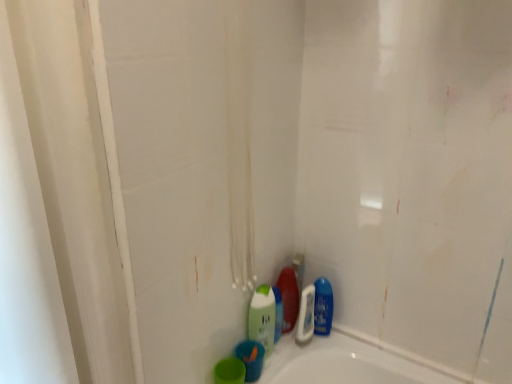
Question: From a real-world perspective, is blue glossy mouthwash at lower right, arranged as the 3th mouthwash when viewed from the left, physically below shiny plastic bottle at lower center, the second cleaning product viewed from the right?

Choices:
 (A) yes
 (B) no

Answer: (A)

Question: From the image's perspective, does blue glossy mouthwash at lower right, the first mouthwash when ordered from right to left, appear lower than shiny plastic bottle at lower center, the second cleaning product viewed from the right?

Choices:
 (A) yes
 (B) no

Answer: (A)

Question: Would you say blue glossy mouthwash at lower right, the first mouthwash when ordered from right to left, is outside shiny plastic bottle at lower center, the second cleaning product viewed from the right?

Choices:
 (A) yes
 (B) no

Answer: (A)

Question: Does blue glossy mouthwash at lower right, the first mouthwash when ordered from right to left, come in front of shiny plastic bottle at lower center, which is the 2th cleaning product in left-to-right order?

Choices:
 (A) yes
 (B) no

Answer: (B)

Question: Is blue glossy mouthwash at lower right, which is the 3th mouthwash from front to back, not close to shiny plastic bottle at lower center, the second cleaning product viewed from the right?

Choices:
 (A) no
 (B) yes

Answer: (A)

Question: Does blue glossy mouthwash at lower right, arranged as the 3th mouthwash when viewed from the left, have a smaller size compared to shiny plastic bottle at lower center, which is the 2th cleaning product in left-to-right order?

Choices:
 (A) no
 (B) yes

Answer: (A)

Question: Is green matte bottle at lower center, acting as the 1th cleaning product starting from the left, thinner than blue glossy mouthwash at lower right, acting as the 1th mouthwash starting from the back?

Choices:
 (A) yes
 (B) no

Answer: (B)

Question: Does green matte bottle at lower center, acting as the 1th cleaning product starting from the left, touch blue glossy mouthwash at lower right, which is the 3th mouthwash from front to back?

Choices:
 (A) yes
 (B) no

Answer: (B)

Question: Is green matte bottle at lower center, acting as the 1th cleaning product starting from the left, not close to blue glossy mouthwash at lower right, arranged as the 3th mouthwash when viewed from the left?

Choices:
 (A) no
 (B) yes

Answer: (A)

Question: From the image's perspective, is green matte bottle at lower center, marked as the 3th cleaning product in a right-to-left arrangement, above blue glossy mouthwash at lower right, the first mouthwash when ordered from right to left?

Choices:
 (A) no
 (B) yes

Answer: (A)

Question: Is green matte bottle at lower center, acting as the 1th cleaning product starting from the left, positioned behind blue glossy mouthwash at lower right, acting as the 1th mouthwash starting from the back?

Choices:
 (A) yes
 (B) no

Answer: (B)

Question: Is green matte bottle at lower center, marked as the 3th cleaning product in a right-to-left arrangement, taller than blue glossy mouthwash at lower right, arranged as the 3th mouthwash when viewed from the left?

Choices:
 (A) yes
 (B) no

Answer: (A)

Question: Is shiny plastic bottle at lower center, which is the 2th cleaning product in left-to-right order, next to blue glossy bottle at lower right, the 1th cleaning product viewed from the right?

Choices:
 (A) yes
 (B) no

Answer: (A)